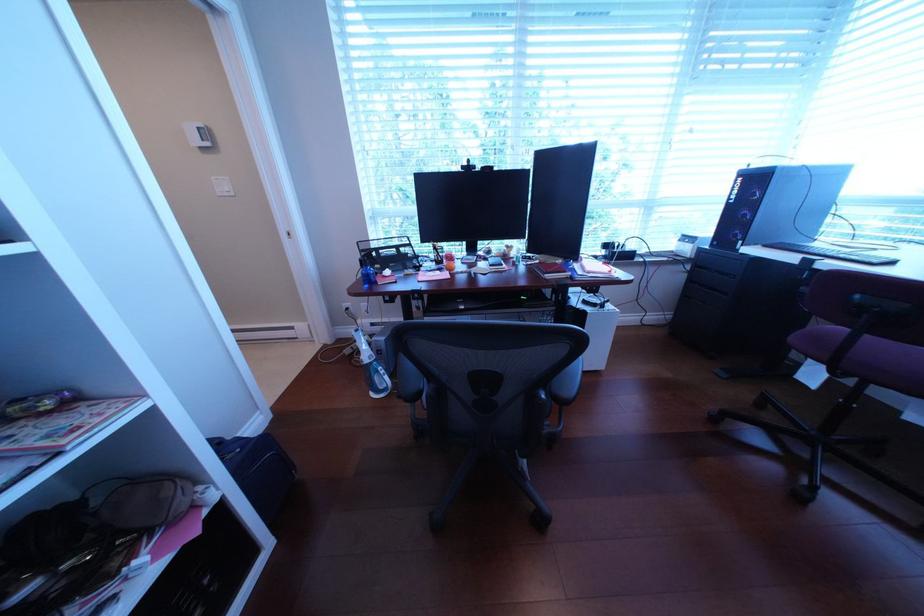
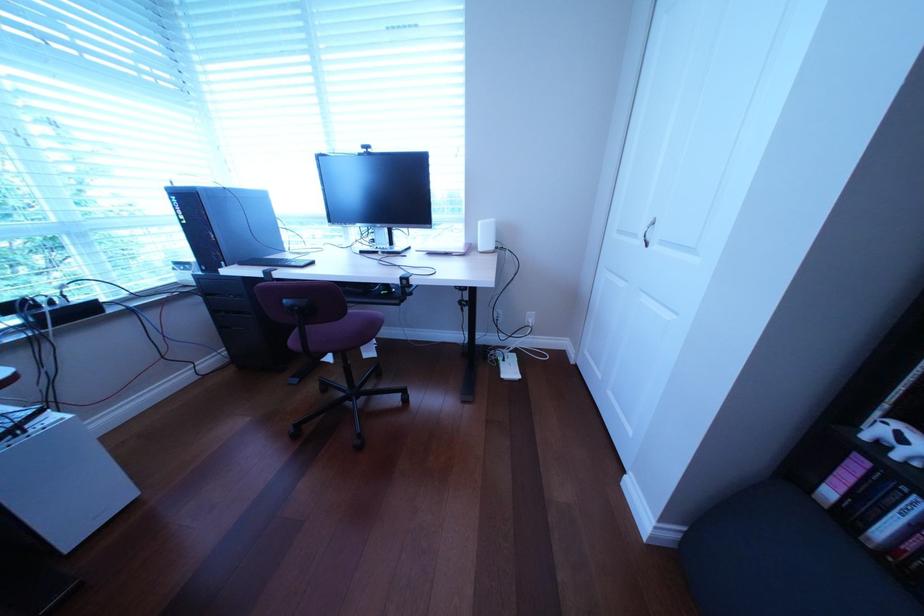
Based on the photo, how did the camera likely rotate?

The camera's rotation is toward right-down.